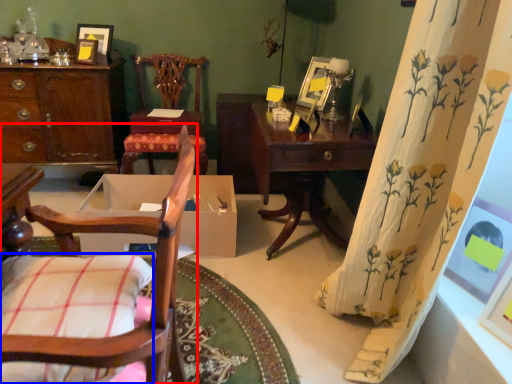
Question: Which of the following is the closest to the observer, chair (highlighted by a red box) or pillow (highlighted by a blue box)?

Choices:
 (A) chair
 (B) pillow

Answer: (A)